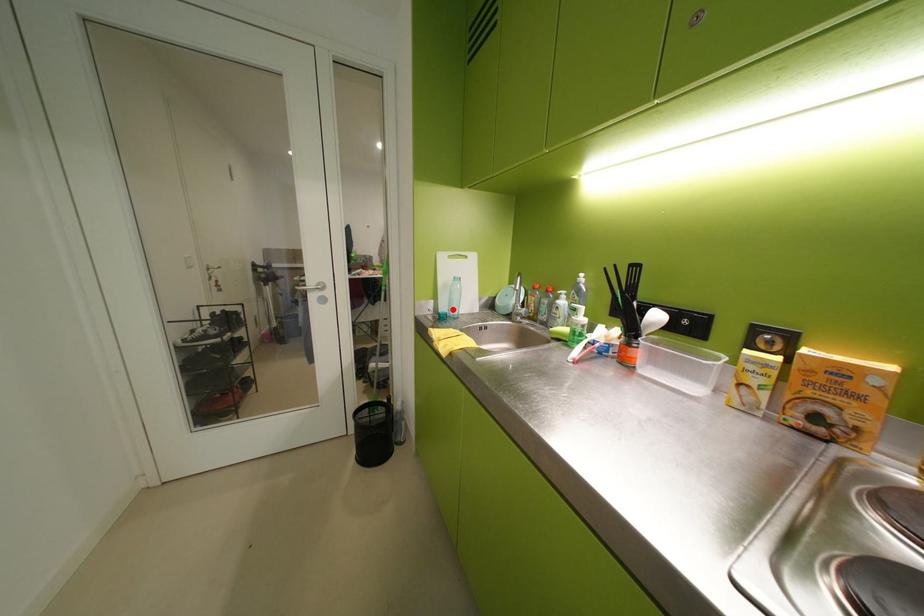
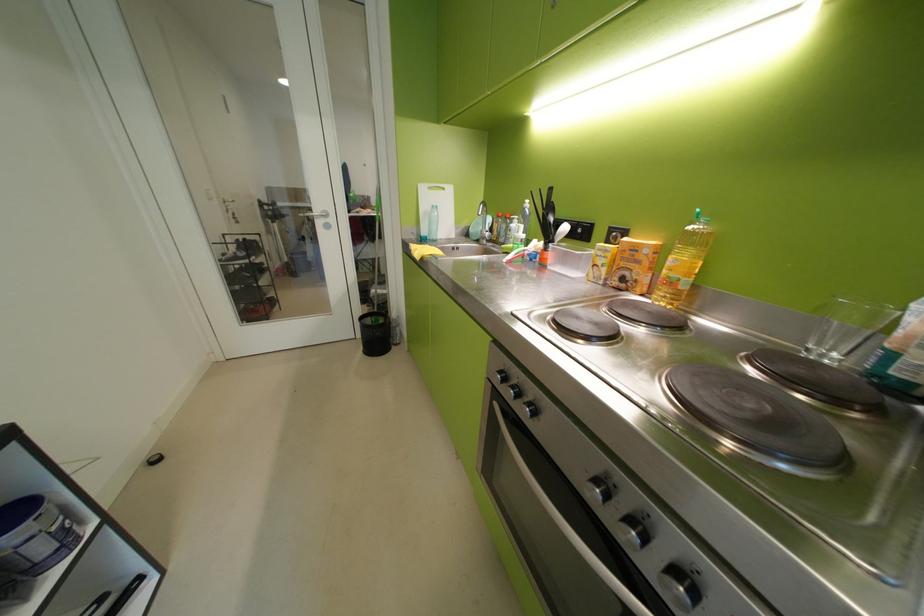
Where in the second image is the point corresponding to the highlighted location from the first image?

(433, 233)